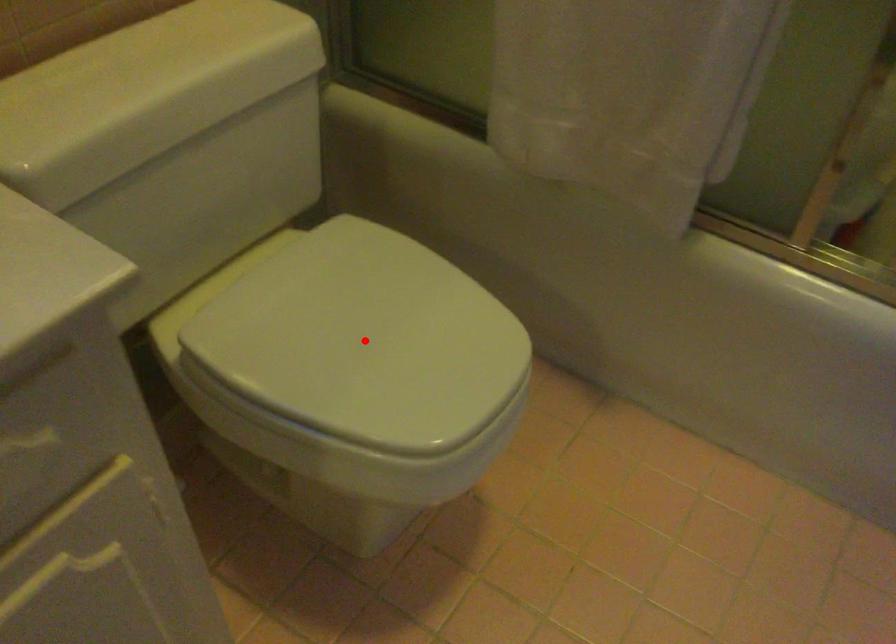
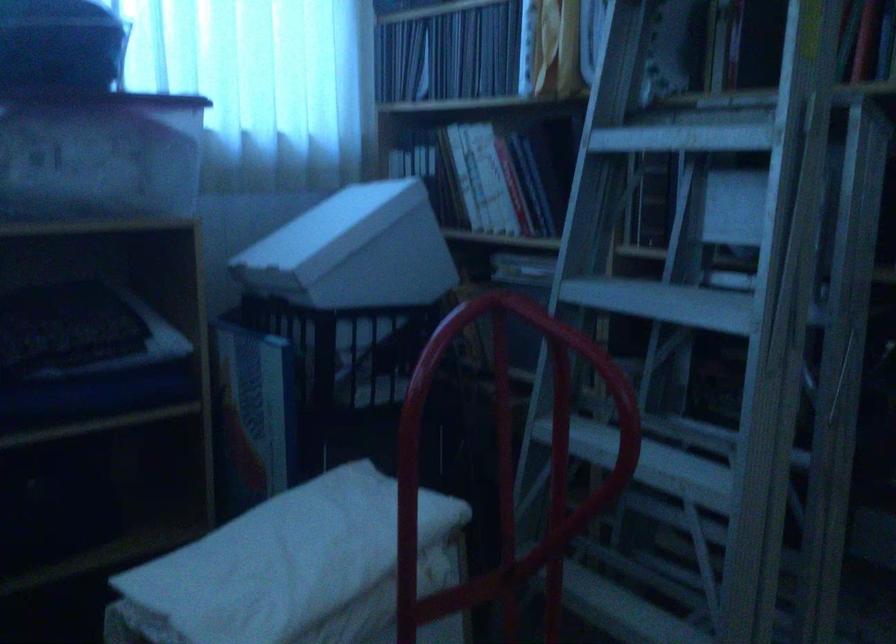
Question: I am providing you with two images of the same scene from different viewpoints. A red point is marked on the first image. At the location where the point appears in image 1, is it still visible in image 2?

Choices:
 (A) Yes
 (B) No

Answer: (B)